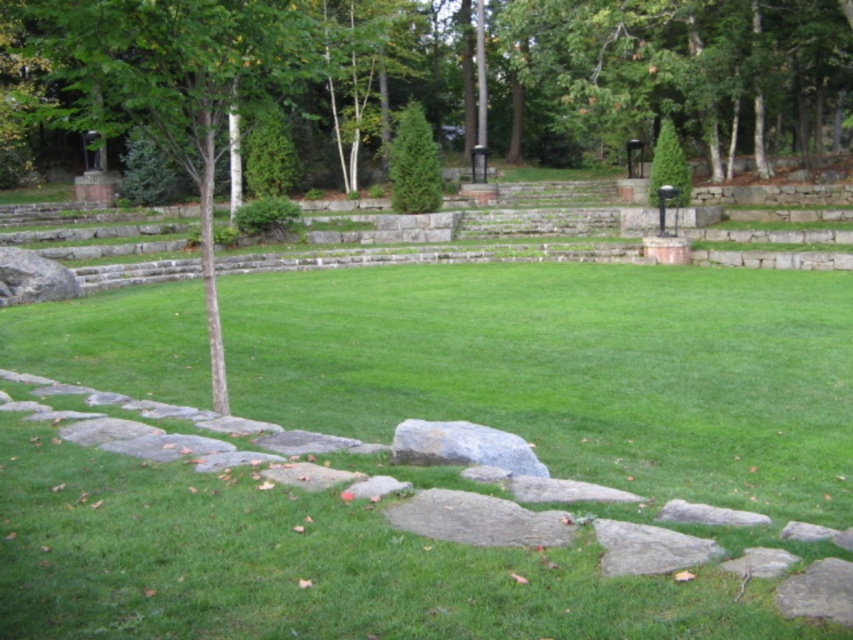
Between green smooth tree at left and gray/rough rock at center, which one appears on the left side from the viewer's perspective?

Positioned to the left is green smooth tree at left.

Does green smooth tree at left have a greater height compared to gray/rough rock at center?

Correct, green smooth tree at left is much taller as gray/rough rock at center.

This screenshot has width=853, height=640. What do you see at coordinates (178, 81) in the screenshot?
I see `green smooth tree at left` at bounding box center [178, 81].

The width and height of the screenshot is (853, 640). I want to click on green smooth tree at left, so click(x=178, y=81).